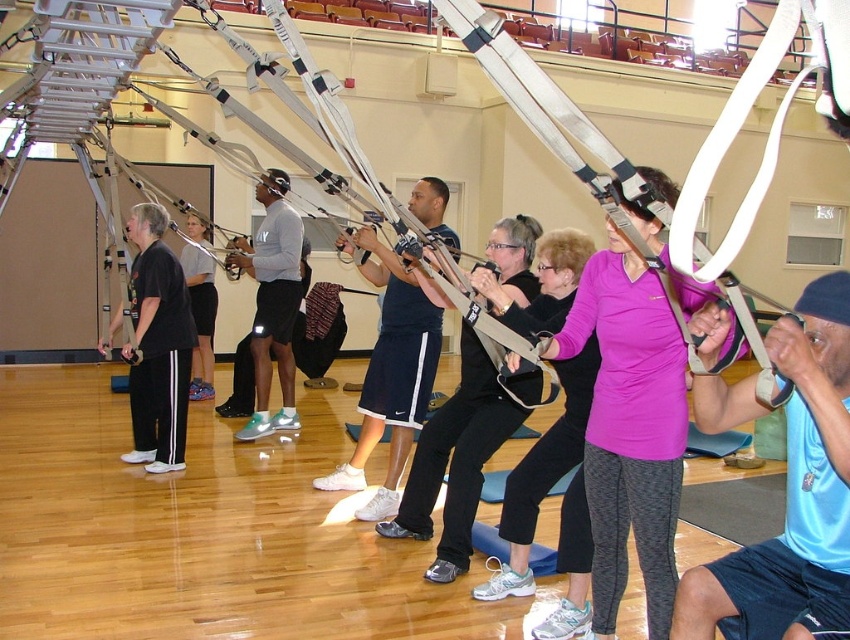
Who is higher up, pink matte shirt at center or matte pink shirt at center?

pink matte shirt at center is above.

Does pink matte shirt at center appear on the right side of matte pink shirt at center?

Correct, you'll find pink matte shirt at center to the right of matte pink shirt at center.

Who is more distant from viewer, (615, 262) or (557, 305)?

Positioned behind is point (557, 305).

The height and width of the screenshot is (640, 850). I want to click on pink matte shirt at center, so click(x=629, y=429).

Does matte pink shirt at center appear under black matte/black pants at left?

Yes.

Who is more distant from viewer, (548, 305) or (156, 301)?

Point (156, 301)

Where is `matte pink shirt at center`? This screenshot has height=640, width=850. matte pink shirt at center is located at coordinates (561, 508).

Is point (139, 461) positioned behind point (208, 321)?

No, (139, 461) is closer to viewer.

Does black matte/black pants at left lie in front of matte black shorts at center?

Yes, black matte/black pants at left is closer to the viewer.

Which is in front, point (156, 444) or point (207, 292)?

Point (156, 444) is in front.

Find the location of a particular element. black matte/black pants at left is located at coordinates (157, 346).